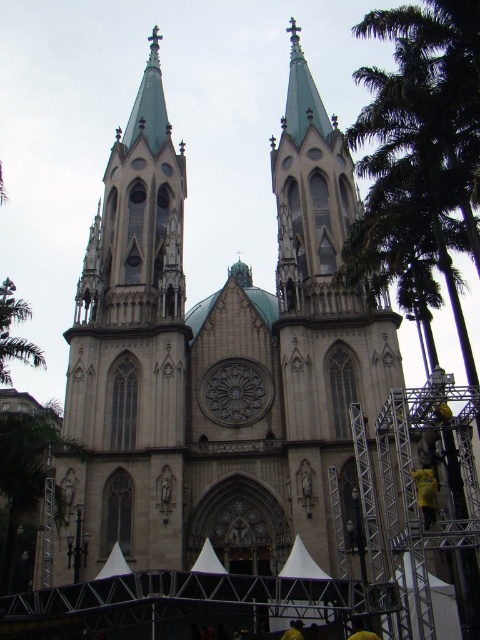
Between green leafy palm tree at right and green leafy tree at left, which one appears on the right side from the viewer's perspective?

green leafy palm tree at right is more to the right.

Who is more forward, (x=356, y=26) or (x=4, y=344)?

Point (x=4, y=344) is more forward.

What are the coordinates of `green leafy palm tree at right` in the screenshot? It's located at (428, 116).

Which is more to the right, matte stone tower at center or green leafy palm tree at right?

green leafy palm tree at right is more to the right.

Between point (107, 168) and point (384, 173), which one is positioned in front?

Point (384, 173) is more forward.

Identify the location of matte stone tower at center. This screenshot has height=640, width=480. (131, 349).

Based on the photo, which is more to the right, matte stone tower at center or green leafy tree at left?

From the viewer's perspective, matte stone tower at center appears more on the right side.

Identify the location of matte stone tower at center. (131, 349).